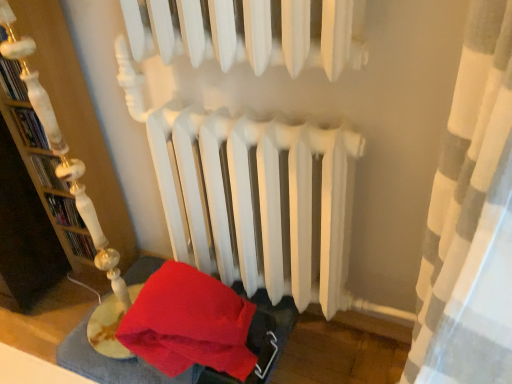
Question: Is wooden bookshelf at left positioned far away from velvet red blanket at lower left?

Choices:
 (A) no
 (B) yes

Answer: (A)

Question: Does wooden bookshelf at left appear on the left side of velvet red blanket at lower left?

Choices:
 (A) no
 (B) yes

Answer: (B)

Question: Is wooden bookshelf at left not within velvet red blanket at lower left?

Choices:
 (A) yes
 (B) no

Answer: (A)

Question: From the image's perspective, does wooden bookshelf at left appear higher than velvet red blanket at lower left?

Choices:
 (A) no
 (B) yes

Answer: (B)

Question: Considering the relative sizes of wooden bookshelf at left and velvet red blanket at lower left in the image provided, is wooden bookshelf at left thinner than velvet red blanket at lower left?

Choices:
 (A) yes
 (B) no

Answer: (A)

Question: Does wooden bookshelf at left have a smaller size compared to velvet red blanket at lower left?

Choices:
 (A) no
 (B) yes

Answer: (A)

Question: Are velvet red blanket at lower left and wooden bookshelf at left far apart?

Choices:
 (A) yes
 (B) no

Answer: (B)

Question: Can you confirm if velvet red blanket at lower left is bigger than wooden bookshelf at left?

Choices:
 (A) yes
 (B) no

Answer: (B)

Question: Does velvet red blanket at lower left come behind wooden bookshelf at left?

Choices:
 (A) no
 (B) yes

Answer: (B)

Question: Can you confirm if velvet red blanket at lower left is wider than wooden bookshelf at left?

Choices:
 (A) no
 (B) yes

Answer: (B)

Question: Considering the relative sizes of velvet red blanket at lower left and wooden bookshelf at left in the image provided, is velvet red blanket at lower left shorter than wooden bookshelf at left?

Choices:
 (A) no
 (B) yes

Answer: (B)

Question: Does velvet red blanket at lower left come in front of wooden bookshelf at left?

Choices:
 (A) no
 (B) yes

Answer: (A)

Question: In terms of height, does velvet red blanket at lower left look taller or shorter compared to wooden bookshelf at left?

Choices:
 (A) short
 (B) tall

Answer: (A)